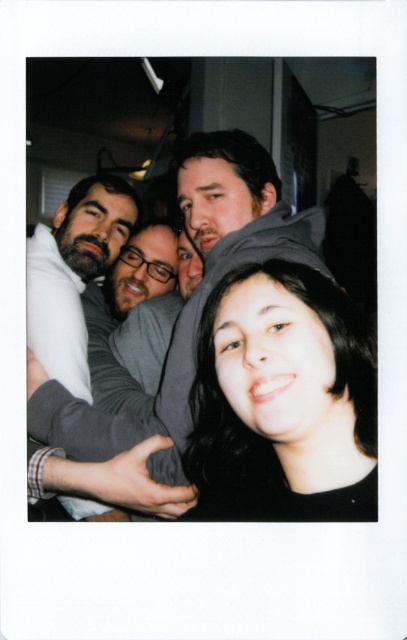
Does black matte hair at center have a greater height compared to dark gray sweater at left?

Incorrect, black matte hair at center's height is not larger of dark gray sweater at left's.

Is point (203, 440) farther from viewer compared to point (113, 212)?

No, it is not.

At what (x,y) coordinates should I click in order to perform the action: click on black matte hair at center. Please return your answer as a coordinate pair (x, y). Looking at the image, I should click on (282, 401).

What are the coordinates of `black matte hair at center` in the screenshot? It's located at (x=282, y=401).

Based on the photo, is black matte hair at center behind gray hoodie at center?

No.

Is black matte hair at center shorter than gray hoodie at center?

Correct, black matte hair at center is not as tall as gray hoodie at center.

Locate an element on the screen. black matte hair at center is located at coordinates (282, 401).

Is point (306, 243) positioned before point (35, 285)?

Yes, it is in front of point (35, 285).

Is point (238, 200) in front of point (70, 332)?

That is True.

Identify the location of gray hoodie at center. The height and width of the screenshot is (640, 407). (194, 292).